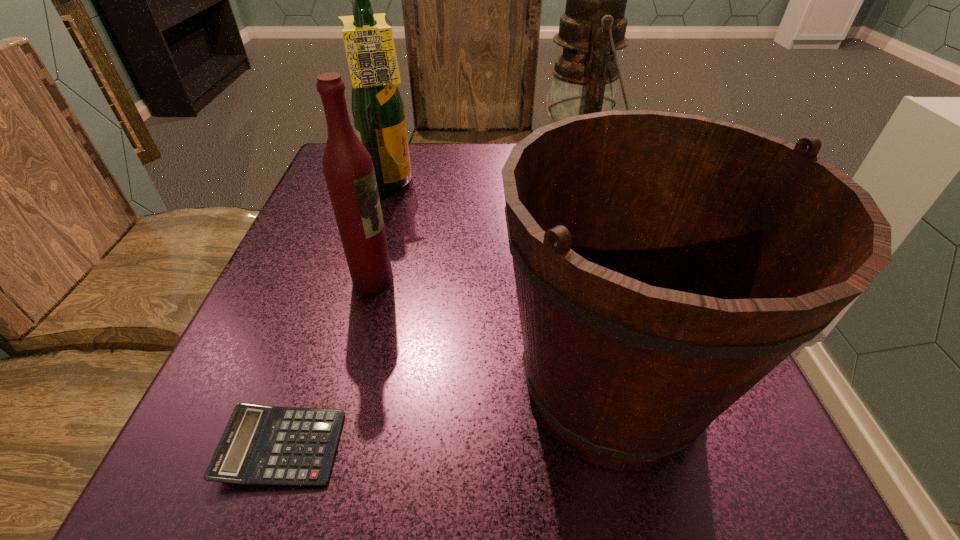
Identify the location of lantern. (593, 27).

At what (x,y) coordinates should I click in order to perform the action: click on the farther liquor. Please return your answer as a coordinate pair (x, y). The width and height of the screenshot is (960, 540). Looking at the image, I should click on (377, 107).

The width and height of the screenshot is (960, 540). In order to click on the nearer liquor in this screenshot , I will do `click(348, 169)`.

Find the location of a particular element. Image resolution: width=960 pixels, height=540 pixels. the shorter liquor is located at coordinates (348, 169).

I want to click on bucket, so click(x=665, y=263).

The image size is (960, 540). Find the location of `the shortest object`. the shortest object is located at coordinates (261, 445).

Where is `free space located on the front of the lantern`? This screenshot has height=540, width=960. free space located on the front of the lantern is located at coordinates (599, 256).

Locate an element on the screen. The image size is (960, 540). vacant space located on the front-facing side of the farther liquor is located at coordinates (467, 185).

Locate an element on the screen. The image size is (960, 540). free point located 0.360m on the label of the shorter liquor is located at coordinates pos(608,280).

At what (x,y) coordinates should I click in order to perform the action: click on vacant space located 0.100m on the back of the bucket. Please return your answer as a coordinate pair (x, y). The height and width of the screenshot is (540, 960). Looking at the image, I should click on (581, 255).